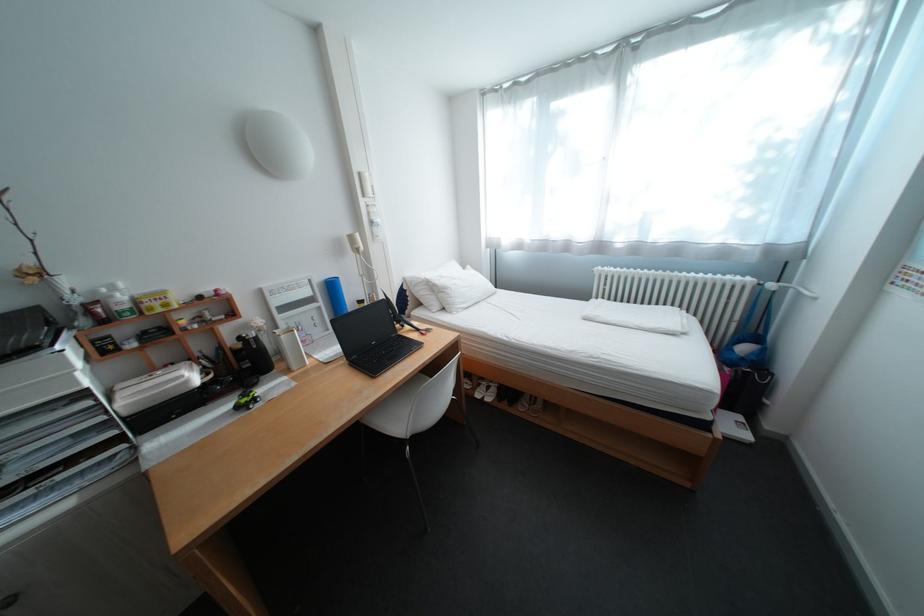
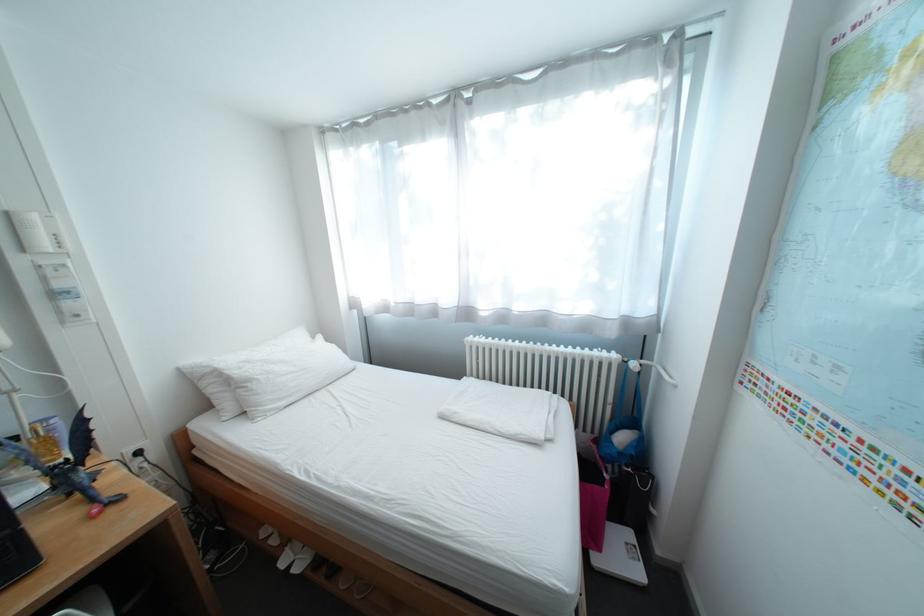
The point at (x=496, y=398) is marked in the first image. Where is the corresponding point in the second image?

(307, 562)